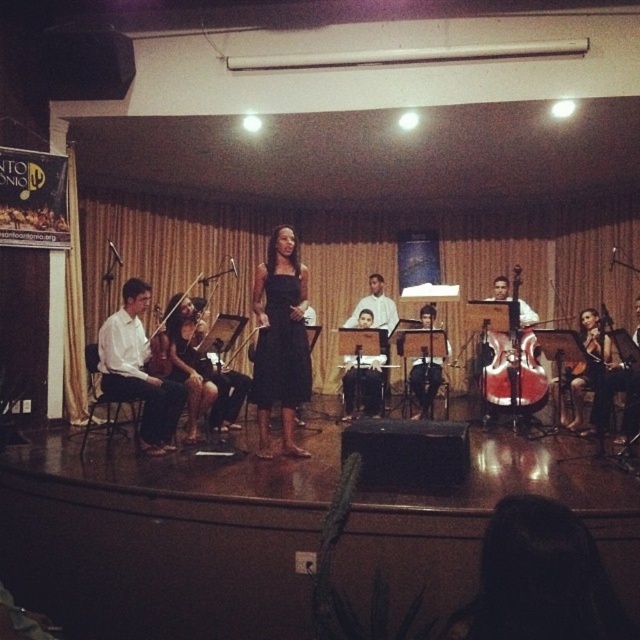
Who is more distant from viewer, (259, 365) or (602, 349)?

The point (602, 349) is more distant.

Who is more forward, (260, 291) or (576, 337)?

Positioned in front is point (260, 291).

I want to click on black satin dress at center, so click(x=280, y=340).

Which is more to the left, black satin dress at center or red glossy cello at center right?

black satin dress at center

Does black satin dress at center appear on the left side of red glossy cello at center right?

Yes, black satin dress at center is to the left of red glossy cello at center right.

Is point (298, 452) positioned behind point (515, 390)?

That is False.

At what (x,y) coordinates should I click in order to perform the action: click on black satin dress at center. Please return your answer as a coordinate pair (x, y). Looking at the image, I should click on (x=280, y=340).

Does black satin dress at center have a lesser width compared to white smooth shirt at left?

Yes, black satin dress at center is thinner than white smooth shirt at left.

Does black satin dress at center have a lesser height compared to white smooth shirt at left?

No.

This screenshot has height=640, width=640. I want to click on black satin dress at center, so click(280, 340).

Image resolution: width=640 pixels, height=640 pixels. What are the coordinates of `black satin dress at center` in the screenshot? It's located at (280, 340).